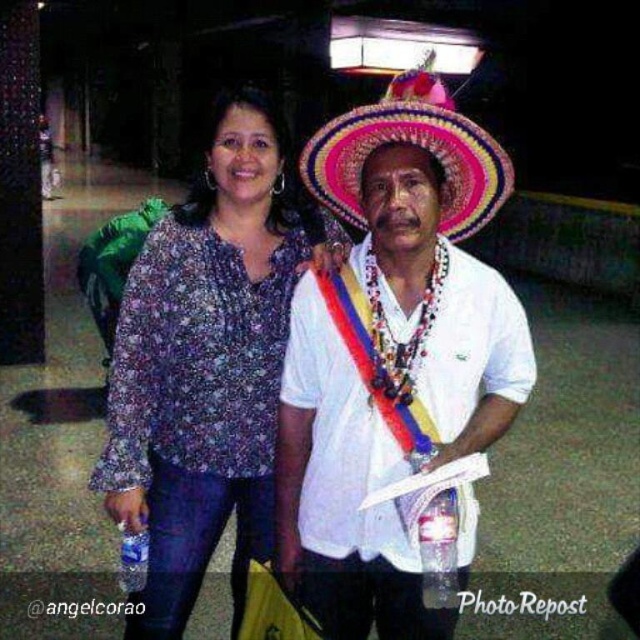
Question: Which point is farther to the camera?

Choices:
 (A) brightly colored woven hat at center
 (B) white woven hat at center
 (C) printed fabric blouse at center

Answer: (C)

Question: Is white woven hat at center thinner than brightly colored woven hat at center?

Choices:
 (A) no
 (B) yes

Answer: (A)

Question: Based on their relative distances, which object is farther from the brightly colored woven hat at center?

Choices:
 (A) white woven hat at center
 (B) printed fabric blouse at center

Answer: (B)

Question: Is printed fabric blouse at center below brightly colored woven hat at center?

Choices:
 (A) no
 (B) yes

Answer: (B)

Question: Which point is farther to the camera?

Choices:
 (A) (352, 140)
 (B) (145, 499)
 (C) (483, 214)

Answer: (B)

Question: Is the position of white woven hat at center more distant than that of brightly colored woven hat at center?

Choices:
 (A) no
 (B) yes

Answer: (B)